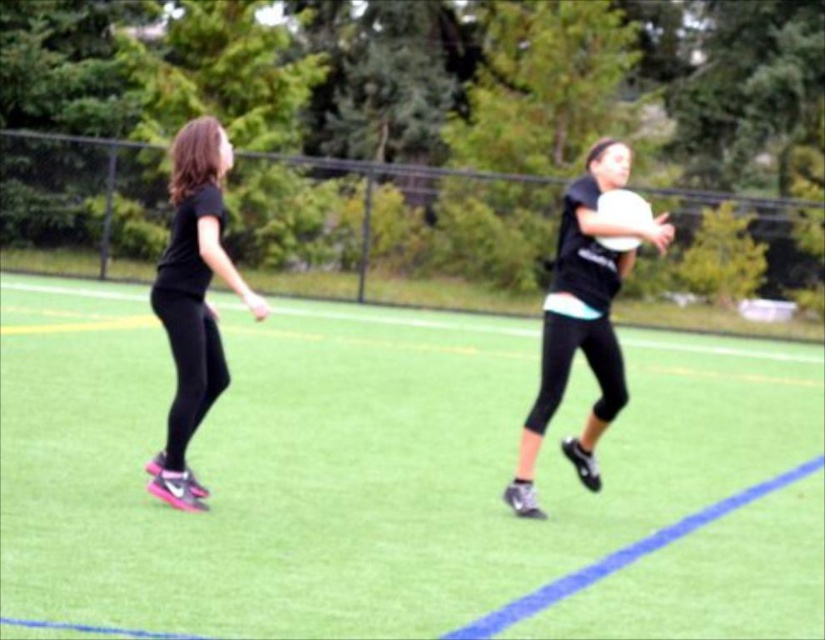
Question: Where is green artificial turf at center located in relation to black matte leggings at left in the image?

Choices:
 (A) left
 (B) right

Answer: (B)

Question: Among these points, which one is nearest to the camera?

Choices:
 (A) (498, 528)
 (B) (215, 378)

Answer: (B)

Question: Does green artificial turf at center appear over black matte leggings at left?

Choices:
 (A) no
 (B) yes

Answer: (A)

Question: Which point is closer to the camera taking this photo?

Choices:
 (A) (203, 358)
 (B) (561, 419)

Answer: (A)

Question: Is green artificial turf at center below black matte leggings at left?

Choices:
 (A) yes
 (B) no

Answer: (A)

Question: Which point is farther to the camera?

Choices:
 (A) green artificial turf at center
 (B) black matte leggings at left

Answer: (B)